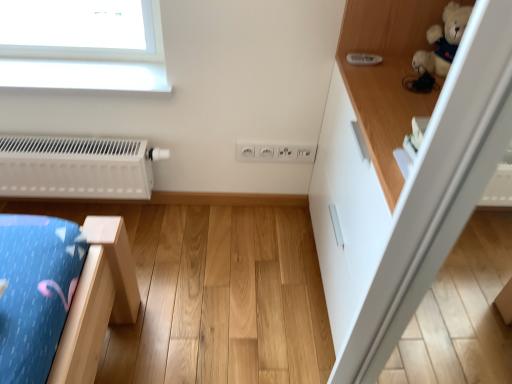
Question: Should I look upward or downward to see white plastic electric outlet at center?

Choices:
 (A) up
 (B) down

Answer: (A)

Question: Is white matte radiator at left positioned with its back to white glossy cabinet at upper right?

Choices:
 (A) yes
 (B) no

Answer: (B)

Question: Would you say white matte radiator at left is a long distance from white glossy cabinet at upper right?

Choices:
 (A) no
 (B) yes

Answer: (A)

Question: Can you confirm if white matte radiator at left is wider than white glossy cabinet at upper right?

Choices:
 (A) yes
 (B) no

Answer: (B)

Question: From the image's perspective, would you say white matte radiator at left is shown under white glossy cabinet at upper right?

Choices:
 (A) yes
 (B) no

Answer: (B)

Question: Is the depth of white matte radiator at left less than that of white glossy cabinet at upper right?

Choices:
 (A) no
 (B) yes

Answer: (A)

Question: Would you say white glossy cabinet at upper right is part of white matte radiator at left's contents?

Choices:
 (A) yes
 (B) no

Answer: (B)

Question: Is white plastic electric outlet at center surrounded by white matte radiator at left?

Choices:
 (A) yes
 (B) no

Answer: (B)

Question: Can you confirm if white matte radiator at left is shorter than white plastic electric outlet at center?

Choices:
 (A) yes
 (B) no

Answer: (B)

Question: Is white matte radiator at left facing away from white plastic electric outlet at center?

Choices:
 (A) no
 (B) yes

Answer: (A)

Question: Is white matte radiator at left wider than white plastic electric outlet at center?

Choices:
 (A) no
 (B) yes

Answer: (B)

Question: Does white matte radiator at left have a larger size compared to white plastic electric outlet at center?

Choices:
 (A) yes
 (B) no

Answer: (A)

Question: Is the surface of white matte radiator at left in direct contact with white plastic electric outlet at center?

Choices:
 (A) no
 (B) yes

Answer: (A)

Question: Is white plastic electric outlet at center smaller than white matte radiator at left?

Choices:
 (A) no
 (B) yes

Answer: (B)